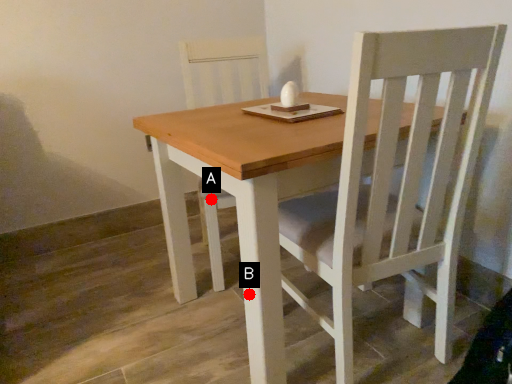
Question: Two points are circled on the image, labeled by A and B beside each circle. Which point is closer to the camera taking this photo?

Choices:
 (A) A is closer
 (B) B is closer

Answer: (B)